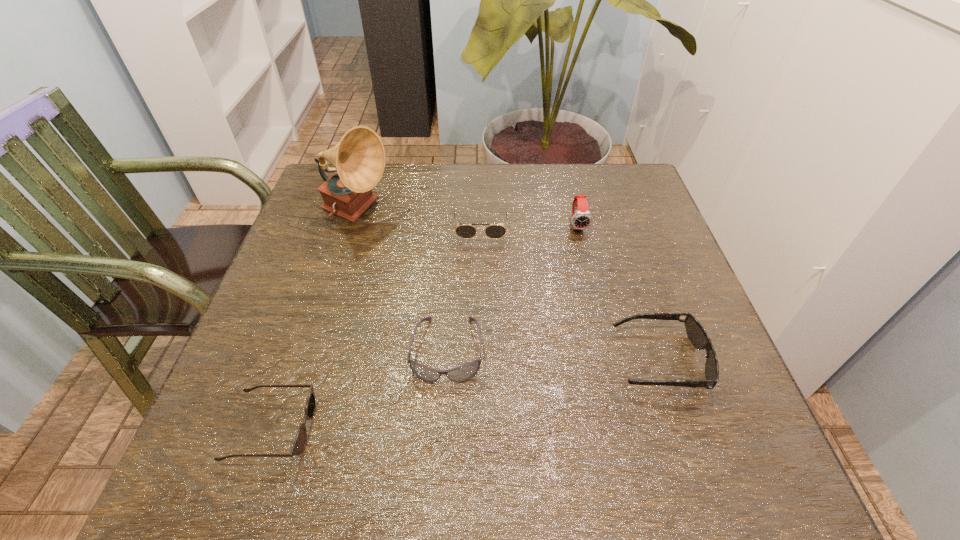
The height and width of the screenshot is (540, 960). Find the location of `object that is positioned at the far left corner`. object that is positioned at the far left corner is located at coordinates (359, 158).

You are a GUI agent. You are given a task and a screenshot of the screen. Output one action in this format:
    pyautogui.click(x=<x>, y=<y>)
    Task: Click on the object located in the near left corner section of the desktop
    
    Given the screenshot: What is the action you would take?
    pyautogui.click(x=299, y=444)

Locate an element on the screen. free region at the far edge of the desktop is located at coordinates (395, 181).

Image resolution: width=960 pixels, height=540 pixels. In order to click on free space at the near edge of the desktop in this screenshot , I will do `click(558, 485)`.

In the image, there is a desktop. Identify the location of vacant space at the left edge. (321, 279).

This screenshot has width=960, height=540. In the image, there is a desktop. Identify the location of vacant space at the right edge. (731, 420).

Image resolution: width=960 pixels, height=540 pixels. In order to click on vacant space at the near left corner of the desktop in this screenshot , I will do `click(233, 463)`.

Identify the location of free space at the far right corner of the desktop. (602, 167).

Locate an element on the screen. This screenshot has height=540, width=960. vacant space at the near right corner of the desktop is located at coordinates (759, 453).

Locate an element on the screen. This screenshot has height=540, width=960. vacant space that's between the tallest object and the second tallest object is located at coordinates (468, 219).